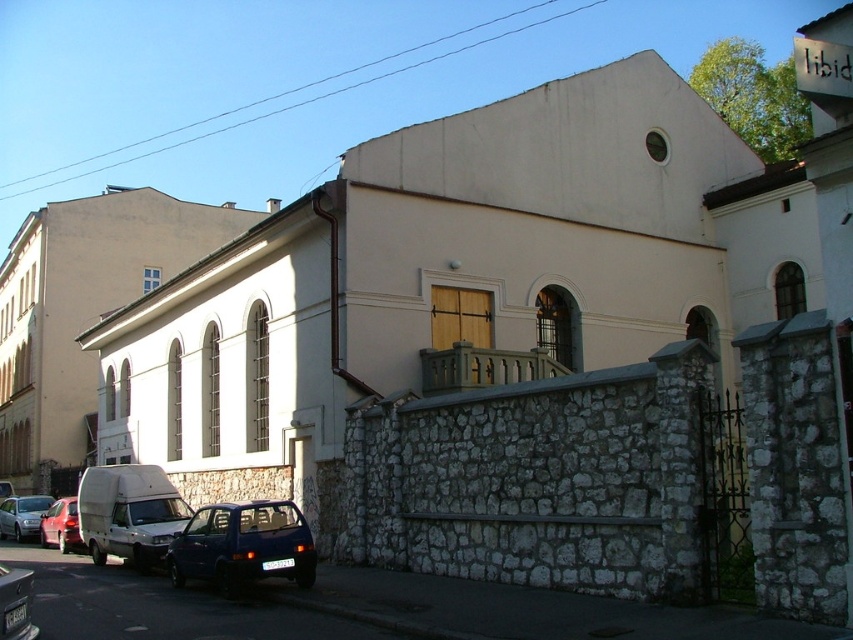
Question: Which point is farther from the camera taking this photo?

Choices:
 (A) (15, 628)
 (B) (136, 513)
 (C) (48, 540)
 (D) (175, 554)

Answer: (C)

Question: Which point is farther from the camera taking this photo?

Choices:
 (A) (13, 522)
 (B) (4, 632)
 (C) (126, 484)

Answer: (A)

Question: Can you confirm if metallic blue car at lower left is bigger than metallic red car at lower left?

Choices:
 (A) yes
 (B) no

Answer: (A)

Question: Which object is positioned closest to the white matte van at lower left?

Choices:
 (A) metallic red car at lower left
 (B) white stone church at upper left
 (C) blue matte hatchback at lower left

Answer: (C)

Question: Is metallic blue car at lower left positioned behind matte silver car at lower left?

Choices:
 (A) yes
 (B) no

Answer: (B)

Question: Can you confirm if white stone church at upper left is positioned below white matte van at lower left?

Choices:
 (A) no
 (B) yes

Answer: (A)